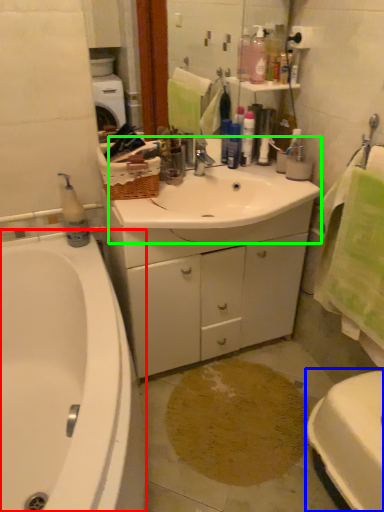
Question: Which is farther away from bathtub (highlighted by a red box)? toilet (highlighted by a blue box) or sink (highlighted by a green box)?

Choices:
 (A) toilet
 (B) sink

Answer: (A)